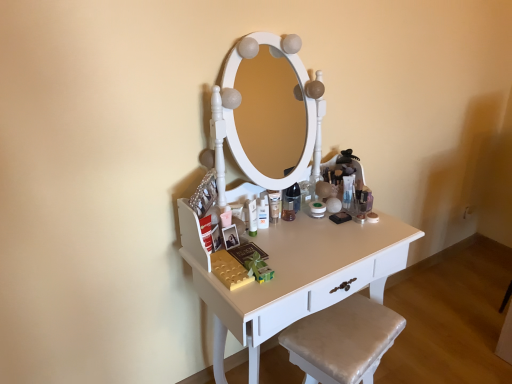
Find the location of a particular element. The height and width of the screenshot is (384, 512). vacant space to the right of matte white lotion at center, which is the first toiletry from left to right is located at coordinates (296, 235).